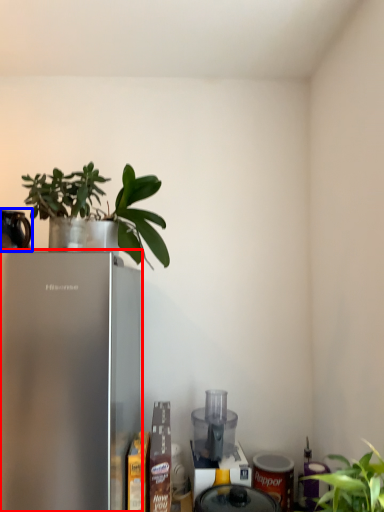
Question: Which point is closer to the camera, refrigerator (highlighted by a red box) or appliance (highlighted by a blue box)?

Choices:
 (A) refrigerator
 (B) appliance

Answer: (A)